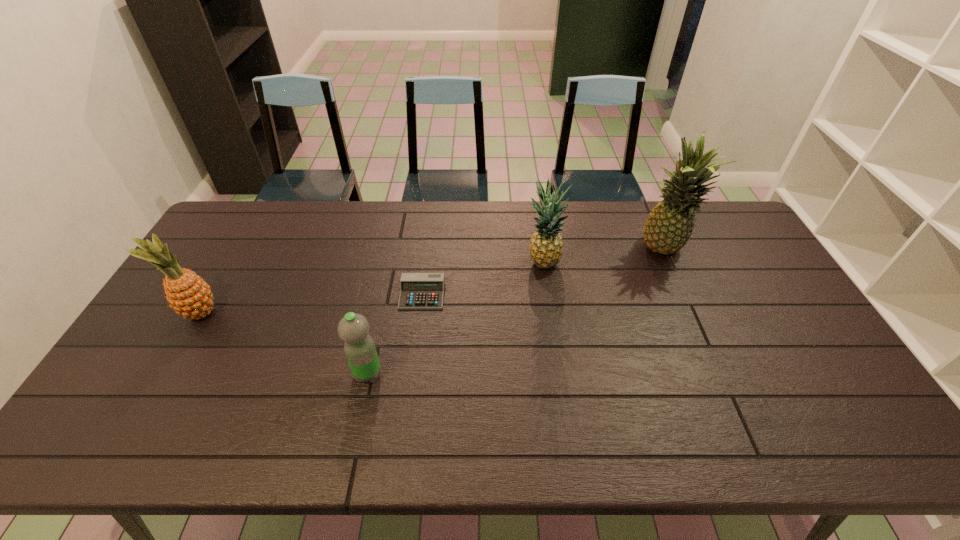
What are the coordinates of `vacant area located on the left of the fourth object from left to right` in the screenshot? It's located at (432, 264).

You are a GUI agent. You are given a task and a screenshot of the screen. Output one action in this format:
    pyautogui.click(x=<x>, y=<y>)
    Task: Click on the blank space located 0.220m on the front of the leftmost object
    
    Given the screenshot: What is the action you would take?
    pyautogui.click(x=151, y=399)

I want to click on free space located 0.190m on the back of the nearest object, so click(x=381, y=308).

Locate an element on the screen. The width and height of the screenshot is (960, 540). vacant point located on the right of the third object from right to left is located at coordinates (526, 294).

You are a GUI agent. You are given a task and a screenshot of the screen. Output one action in this format:
    pyautogui.click(x=<x>, y=<y>)
    Task: Click on the object located at the far edge
    
    Given the screenshot: What is the action you would take?
    pyautogui.click(x=669, y=226)

Identify the location of object at the left edge. (190, 296).

You are a GUI agent. You are given a task and a screenshot of the screen. Output one action in this format:
    pyautogui.click(x=<x>, y=<y>)
    Task: Click on the vacant space at the far edge of the desktop
    
    Given the screenshot: What is the action you would take?
    pyautogui.click(x=355, y=228)

In the image, there is a desktop. Where is `vacant space at the near edge`? Image resolution: width=960 pixels, height=540 pixels. vacant space at the near edge is located at coordinates 231,430.

Locate an element on the screen. free region at the left edge of the desktop is located at coordinates (179, 374).

In the image, there is a desktop. At what (x,y) coordinates should I click in order to perform the action: click on vacant region at the far left corner. Please return your answer as a coordinate pair (x, y). This screenshot has width=960, height=540. Looking at the image, I should click on (261, 217).